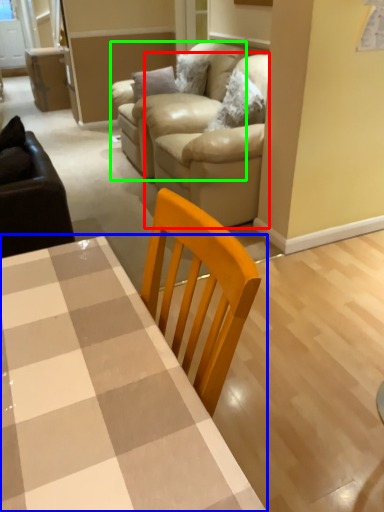
Question: Which object is positioned closest to couch (highlighted by a red box)? Select from table (highlighted by a blue box) and armchair (highlighted by a green box).

Choices:
 (A) table
 (B) armchair

Answer: (B)